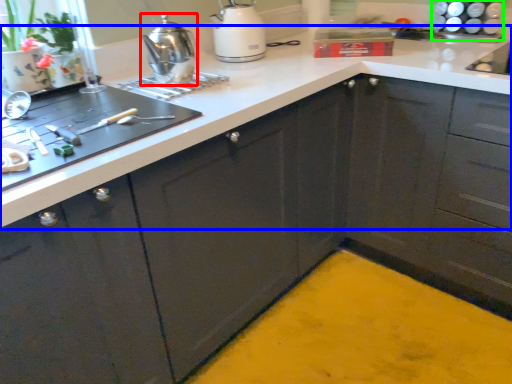
Question: Which object is the farthest from kitchen appliance (highlighted by a red box)? Choose among these: countertop (highlighted by a blue box) or appliance (highlighted by a green box).

Choices:
 (A) countertop
 (B) appliance

Answer: (B)